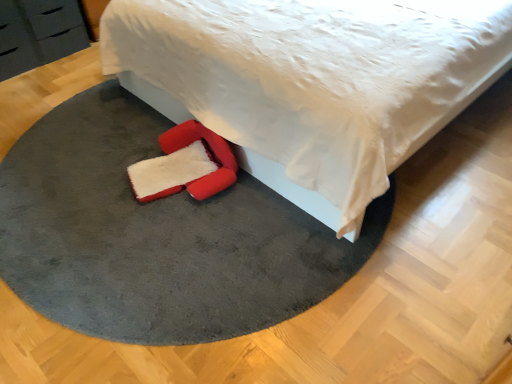
Question: Is velvet gray rug at center at the left side of white soft bed at center?

Choices:
 (A) yes
 (B) no

Answer: (A)

Question: Is white soft bed at center at the back of velvet gray rug at center?

Choices:
 (A) yes
 (B) no

Answer: (B)

Question: From the image's perspective, is velvet gray rug at center located beneath white soft bed at center?

Choices:
 (A) yes
 (B) no

Answer: (A)

Question: Is velvet gray rug at center touching white soft bed at center?

Choices:
 (A) no
 (B) yes

Answer: (A)

Question: Considering the relative sizes of velvet gray rug at center and white soft bed at center in the image provided, is velvet gray rug at center smaller than white soft bed at center?

Choices:
 (A) yes
 (B) no

Answer: (A)

Question: Considering the positions of matte black dresser at upper left and velvet-like red footrest at lower center in the image, is matte black dresser at upper left bigger or smaller than velvet-like red footrest at lower center?

Choices:
 (A) small
 (B) big

Answer: (B)

Question: From a real-world perspective, is matte black dresser at upper left above or below velvet-like red footrest at lower center?

Choices:
 (A) below
 (B) above

Answer: (B)

Question: In terms of width, does matte black dresser at upper left look wider or thinner when compared to velvet-like red footrest at lower center?

Choices:
 (A) thin
 (B) wide

Answer: (B)

Question: In the image, is matte black dresser at upper left positioned in front of or behind velvet-like red footrest at lower center?

Choices:
 (A) behind
 (B) front

Answer: (A)

Question: Visually, is velvet gray rug at center positioned to the left or to the right of velvet-like red footrest at lower center?

Choices:
 (A) right
 (B) left

Answer: (A)

Question: Would you say velvet gray rug at center is inside or outside velvet-like red footrest at lower center?

Choices:
 (A) inside
 (B) outside

Answer: (B)

Question: Does point (198, 279) appear closer or farther from the camera than point (154, 193)?

Choices:
 (A) farther
 (B) closer

Answer: (B)

Question: Is velvet gray rug at center in front of or behind velvet-like red footrest at lower center in the image?

Choices:
 (A) behind
 (B) front

Answer: (B)

Question: Is black matte drawer at upper left taller or shorter than matte black dresser at upper left?

Choices:
 (A) short
 (B) tall

Answer: (B)

Question: In the image, is black matte drawer at upper left on the left side or the right side of matte black dresser at upper left?

Choices:
 (A) right
 (B) left

Answer: (B)